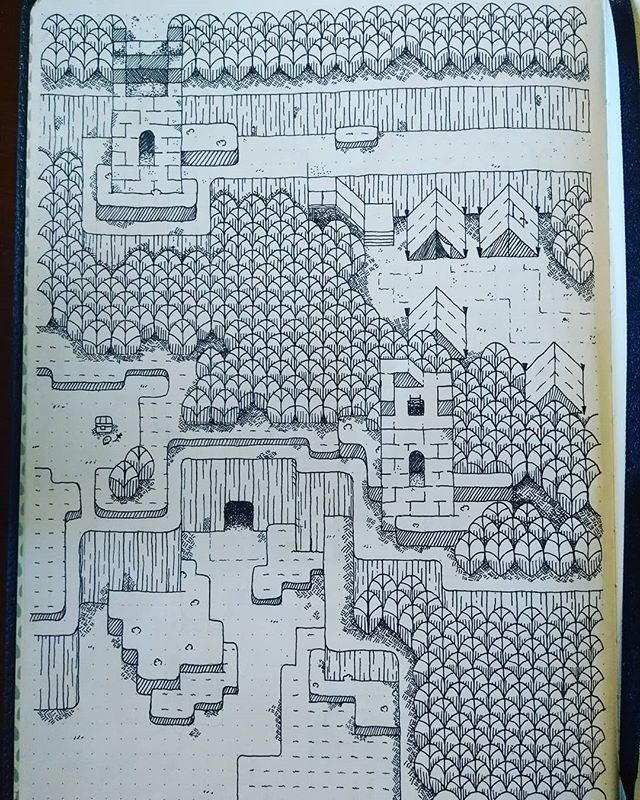
The width and height of the screenshot is (640, 800). I want to click on door, so (144, 146).